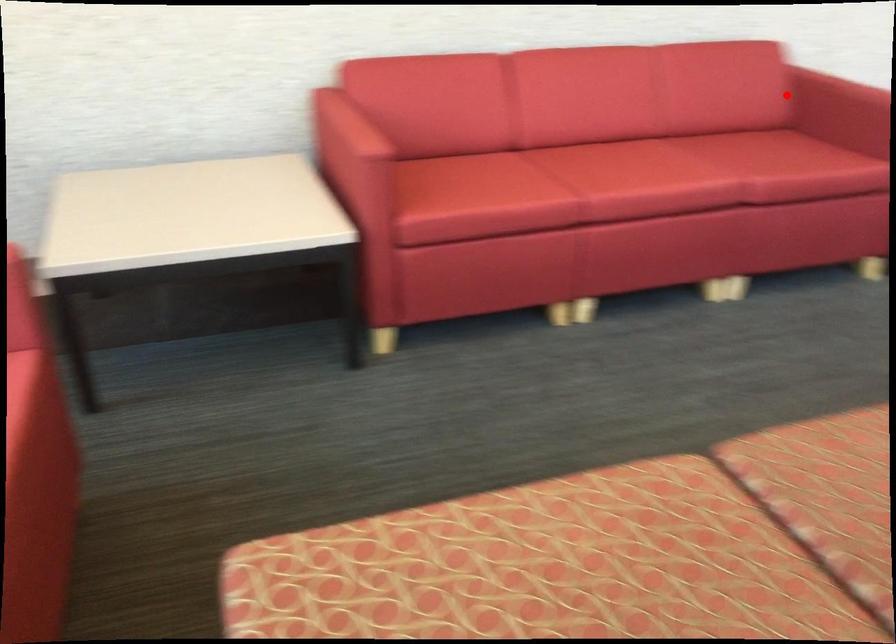
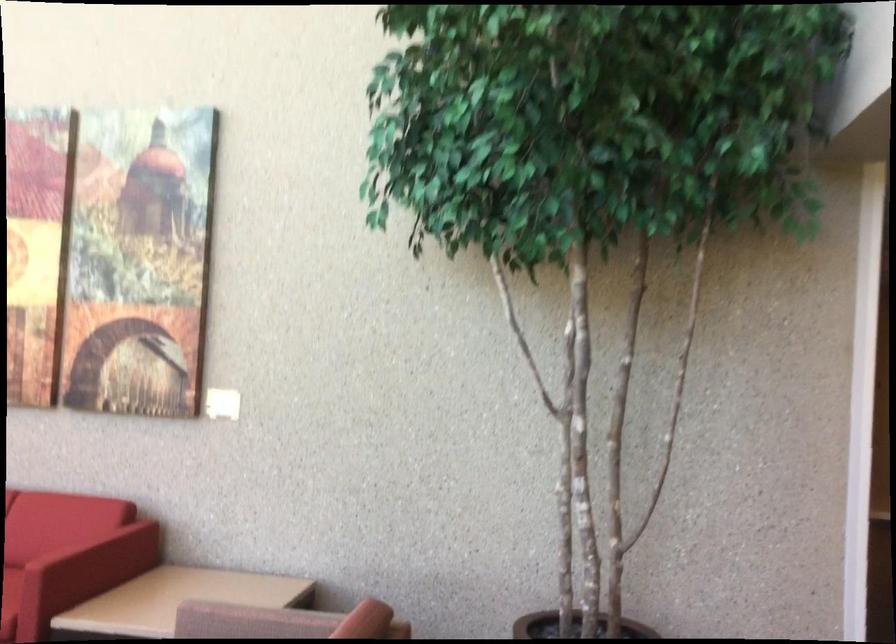
Question: I am providing you with two images of the same scene from different viewpoints. Image1 has a red point marked. In image2, the corresponding 3D location appears at what relative position? Reply with the corresponding letter.

Choices:
 (A) Closer
 (B) Farther

Answer: (B)